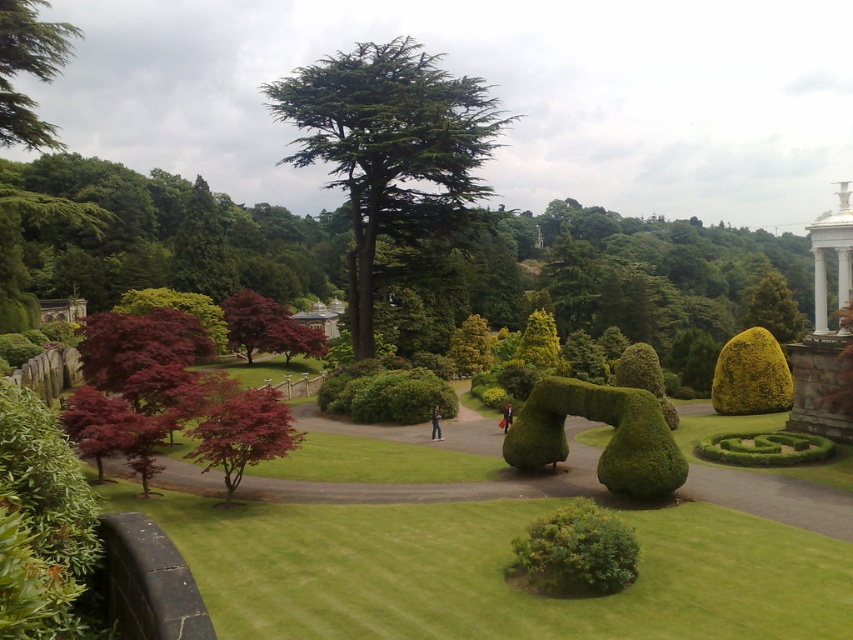
Question: Considering the relative positions of green needle-like tree at center and red fabric coat at center in the image provided, where is green needle-like tree at center located with respect to red fabric coat at center?

Choices:
 (A) above
 (B) below

Answer: (A)

Question: Among these objects, which one is farthest from the camera?

Choices:
 (A) light blue jeans at center
 (B) green leafy tree at upper left
 (C) green needle-like tree at center

Answer: (C)

Question: Which point is closer to the camera?

Choices:
 (A) red fabric coat at center
 (B) green grassy lawn at lower left
 (C) green leafy tree at upper left

Answer: (B)

Question: Which point appears farthest from the camera in this image?

Choices:
 (A) (824, 280)
 (B) (726, 390)
 (C) (4, 106)
 (D) (502, 420)

Answer: (B)

Question: Can you confirm if green leafy tree at upper left is positioned to the left of reddish-brown bark tree at center-left?

Choices:
 (A) no
 (B) yes

Answer: (B)

Question: Does green grassy lawn at lower left appear under reddish-brown bark tree at center-left?

Choices:
 (A) yes
 (B) no

Answer: (A)